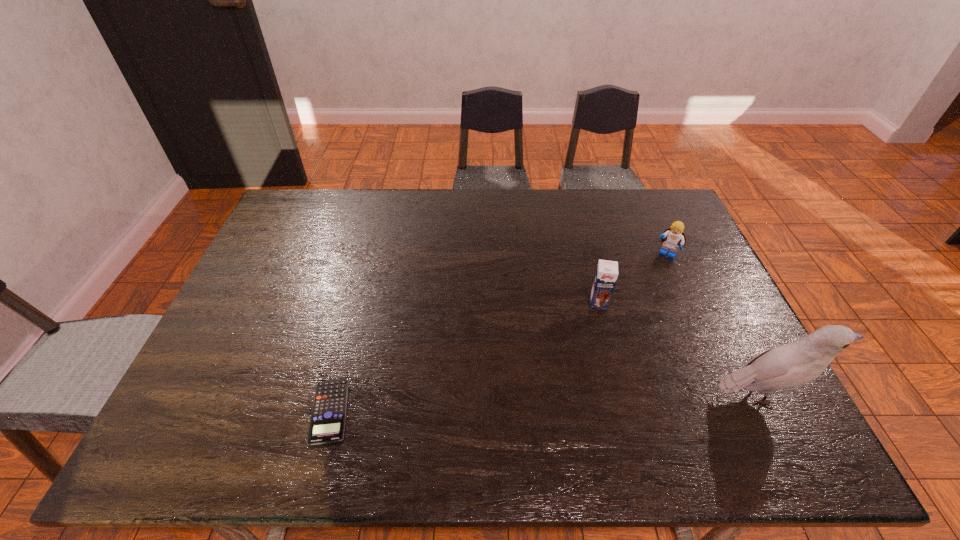
Where is `calculator`? This screenshot has width=960, height=540. calculator is located at coordinates (327, 424).

Locate an element on the screen. Image resolution: width=960 pixels, height=540 pixels. the shortest object is located at coordinates (327, 424).

Identify the location of the tallest object. (790, 365).

Locate an element on the screen. The width and height of the screenshot is (960, 540). the third shortest object is located at coordinates (606, 275).

Where is `the third object from right to left`? The width and height of the screenshot is (960, 540). the third object from right to left is located at coordinates (606, 275).

Identify the location of the farthest object. (673, 237).

The height and width of the screenshot is (540, 960). I want to click on Lego, so click(673, 237).

Where is `free space located on the left of the leftmost object`? The image size is (960, 540). free space located on the left of the leftmost object is located at coordinates (194, 411).

I want to click on free space located 0.190m on the front label of the chocolate milk, so click(x=598, y=366).

Image resolution: width=960 pixels, height=540 pixels. I want to click on vacant area situated on the front label of the chocolate milk, so click(x=598, y=344).